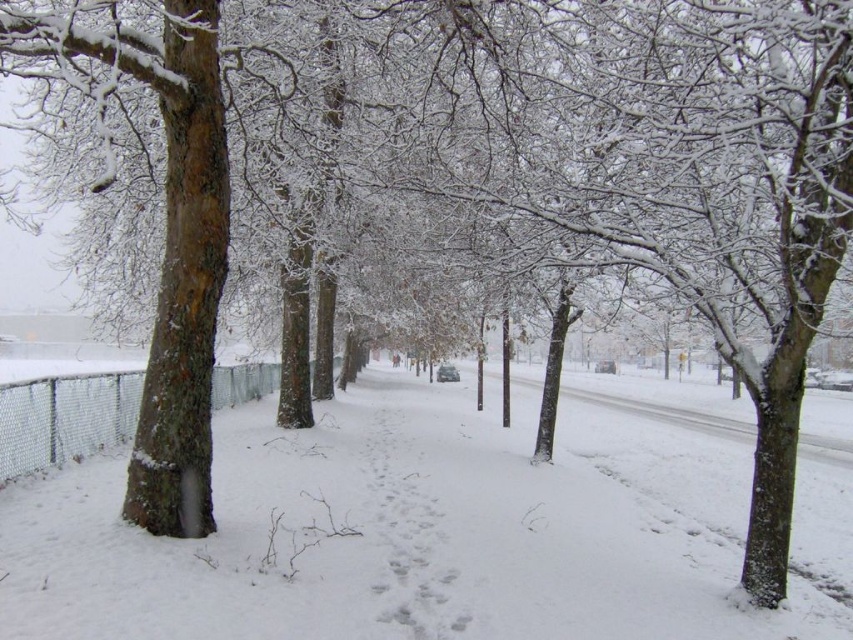
The width and height of the screenshot is (853, 640). What do you see at coordinates (428, 532) in the screenshot? I see `white snow pavement at center` at bounding box center [428, 532].

Between white snow pavement at center and metal mesh fence at left, which one appears on the left side from the viewer's perspective?

metal mesh fence at left

Measure the distance between point (260, 476) and camera.

Point (260, 476) and camera are 9.92 meters apart.

Find the location of a particular element. white snow pavement at center is located at coordinates (428, 532).